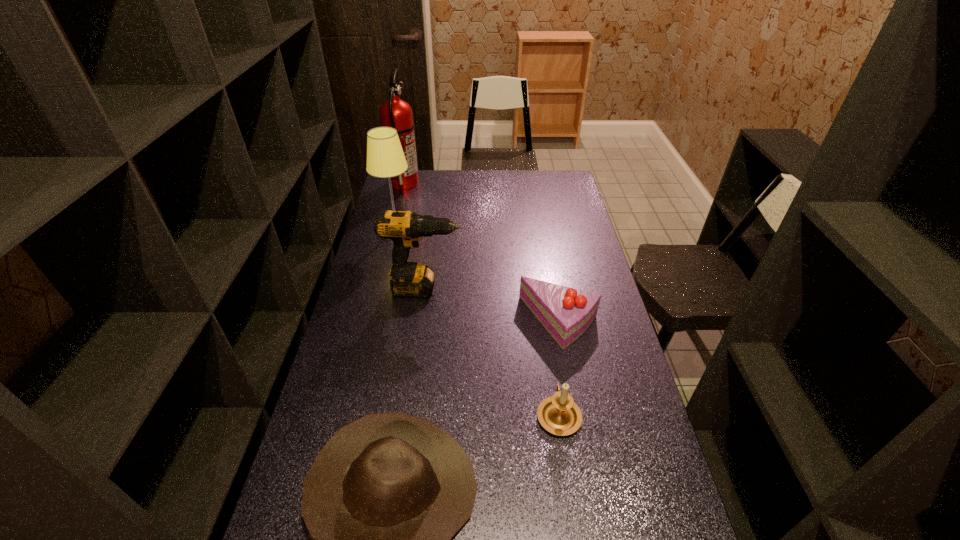
At what (x,y) coordinates should I click in order to perform the action: click on free region at the far edge of the desktop. Please return your answer as a coordinate pair (x, y). The image size is (960, 540). Looking at the image, I should click on (460, 192).

In the image, there is a desktop. Where is `vacant space at the left edge`? vacant space at the left edge is located at coordinates (366, 259).

You are a GUI agent. You are given a task and a screenshot of the screen. Output one action in this format:
    pyautogui.click(x=<x>, y=<y>)
    Task: Click on the vacant position at the right edge of the desktop
    The width and height of the screenshot is (960, 540).
    Given the screenshot: What is the action you would take?
    pyautogui.click(x=598, y=443)

The width and height of the screenshot is (960, 540). Identify the location of vacant space at the far left corner. (401, 193).

The width and height of the screenshot is (960, 540). I want to click on vacant region between the candle holder and the second farthest object, so [477, 322].

At what (x,y) coordinates should I click in order to perform the action: click on vacant space in between the candle holder and the fire extinguisher. Please return your answer as a coordinate pair (x, y). Looking at the image, I should click on (481, 299).

Where is `free space between the fire extinguisher and the candle holder`? This screenshot has width=960, height=540. free space between the fire extinguisher and the candle holder is located at coordinates (481, 299).

Identify the location of vacant space that is in between the cake and the candle holder. (559, 368).

Where is `vacant region between the fifth nearest object and the cake`? Image resolution: width=960 pixels, height=540 pixels. vacant region between the fifth nearest object and the cake is located at coordinates (478, 276).

Where is `free space that is in between the candle holder and the tallest object`? This screenshot has height=540, width=960. free space that is in between the candle holder and the tallest object is located at coordinates (481, 299).